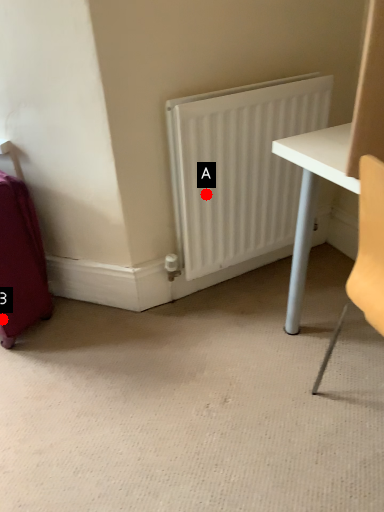
Question: Two points are circled on the image, labeled by A and B beside each circle. Which of the following is the farthest from the observer?

Choices:
 (A) A is further
 (B) B is further

Answer: (B)